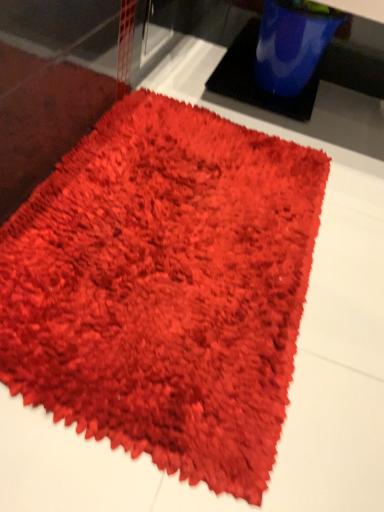
This screenshot has width=384, height=512. In order to click on shaggy red carpet at lower center in this screenshot , I will do `click(165, 288)`.

Describe the element at coordinates (165, 288) in the screenshot. Image resolution: width=384 pixels, height=512 pixels. I see `shaggy red carpet at lower center` at that location.

Where is `shaggy red carpet at lower center`? The height and width of the screenshot is (512, 384). shaggy red carpet at lower center is located at coordinates (165, 288).